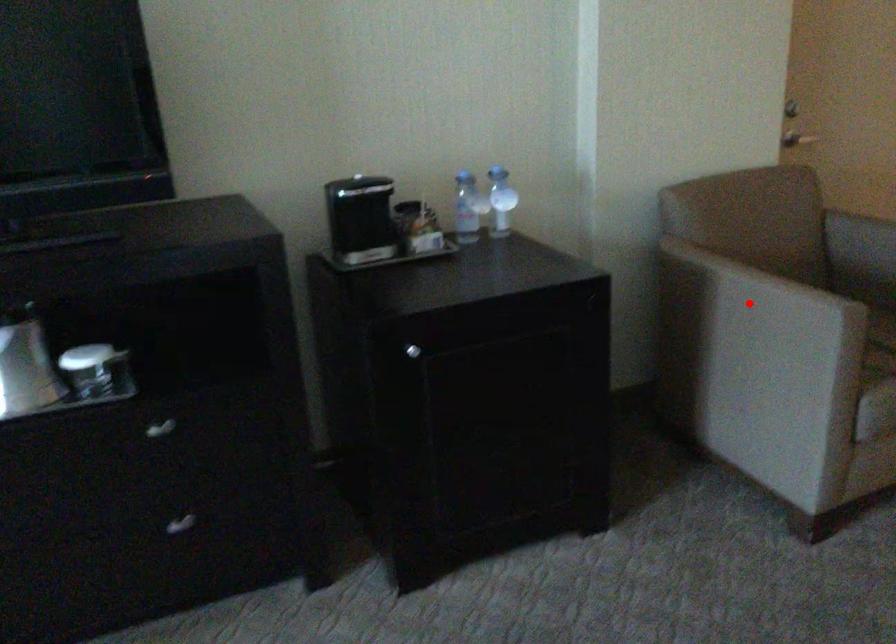
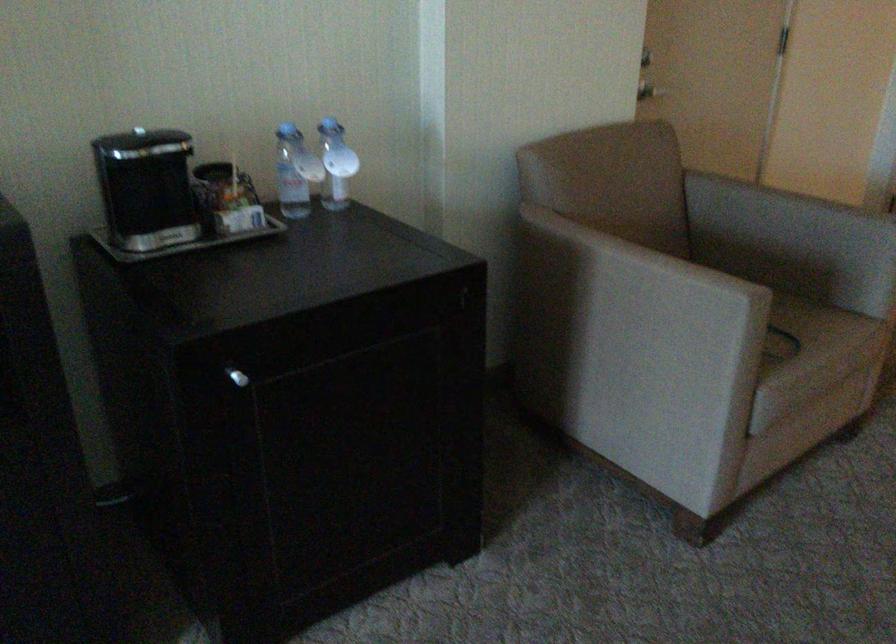
Question: I am providing you with two images of the same scene from different viewpoints. Given a red point in image1, look at the same physical point in image2. Is it:

Choices:
 (A) Closer to the viewpoint
 (B) Farther from the viewpoint

Answer: (A)